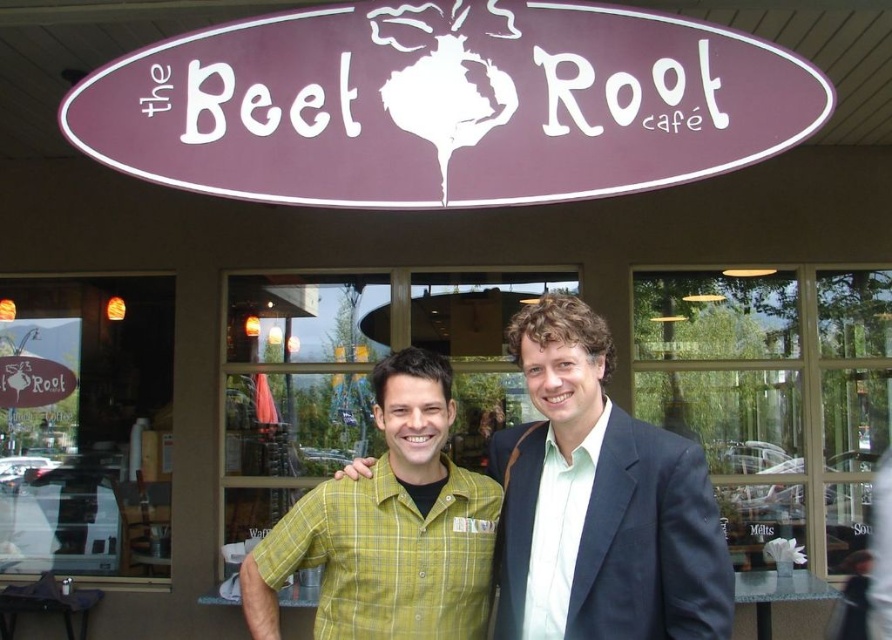
Between point (517, 451) and point (269, 627), which one is positioned behind?

Positioned behind is point (517, 451).

Is point (559, 394) less distant than point (409, 356)?

Yes, it is.

Find the location of `dark blue suit at center`. dark blue suit at center is located at coordinates (599, 502).